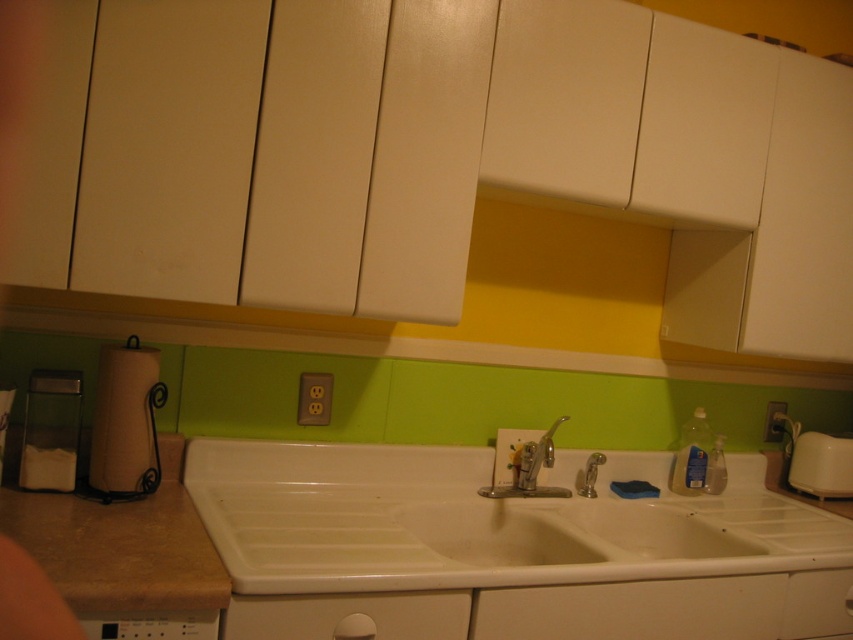
You are a chef who needs to reach both the beige laminate counter top at center and the white plastic toaster at right. Which one is higher from the floor?

The beige laminate counter top at center is much taller than the white plastic toaster at right, so the beige laminate counter top at center is higher from the floor.

From the picture: You are organizing the kitchen and need to place a new spice jar that requires a shelf above the white matte drawer at lower center and the matte brown paper towel holder at lower left. Is there enough vertical space between the drawer and the cabinets above them to accommodate the spice jar?

The white matte drawer at lower center is in front of the matte brown paper towel holder at lower left, meaning they are at different depths. However, the vertical space between them and the cabinets above would depend on the height of the cabinets and the drawer. Since the description does not provide specific measurements, it is uncertain if there is enough space. Please check the actual dimensions.